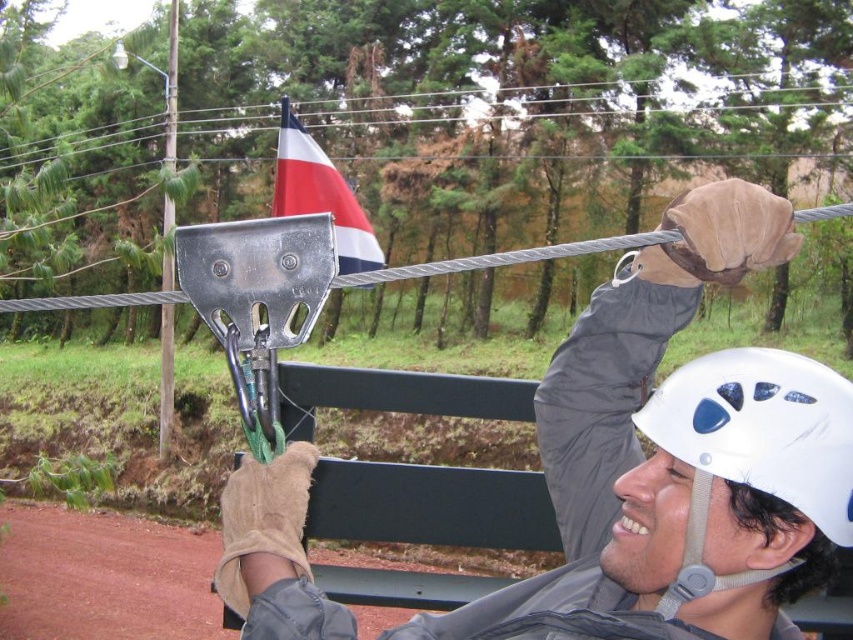
Is metallic gray helmet at upper center to the right of red-white-blue fabric flag at upper center from the viewer's perspective?

Indeed, metallic gray helmet at upper center is positioned on the right side of red-white-blue fabric flag at upper center.

Which is more to the left, metallic gray helmet at upper center or red-white-blue fabric flag at upper center?

red-white-blue fabric flag at upper center is more to the left.

The width and height of the screenshot is (853, 640). What do you see at coordinates (674, 484) in the screenshot?
I see `metallic gray helmet at upper center` at bounding box center [674, 484].

Where is `metallic gray helmet at upper center`? Image resolution: width=853 pixels, height=640 pixels. metallic gray helmet at upper center is located at coordinates (674, 484).

Is metallic gray helmet at upper center bigger than white matte helmet at upper right?

Yes, metallic gray helmet at upper center is bigger than white matte helmet at upper right.

Is point (717, 234) farther from viewer compared to point (686, 397)?

That is True.

Find the location of a particular element. metallic gray helmet at upper center is located at coordinates (674, 484).

In the scene shown: Can you confirm if white matte helmet at upper right is taller than red-white-blue fabric flag at upper center?

No.

Who is positioned more to the right, white matte helmet at upper right or red-white-blue fabric flag at upper center?

Positioned to the right is white matte helmet at upper right.

I want to click on white matte helmet at upper right, so (x=755, y=444).